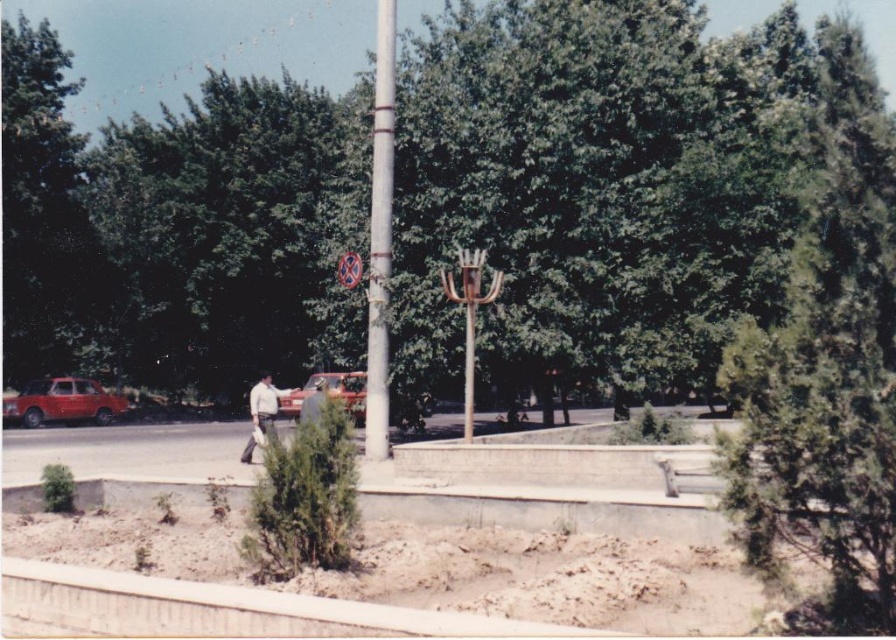
Consider the image. You are a pedestrian standing on the sidewalk near the metallic red car at center and the metallic pole at center. Which object is closer to your right side?

The metallic pole at center is closer to your right side because the metallic red car at center is to the left of it.

You are standing at the point marked by coordinates point (62, 403) in the image. What object are you standing on?

You are standing on the matte red car at left marked by point (62, 403).